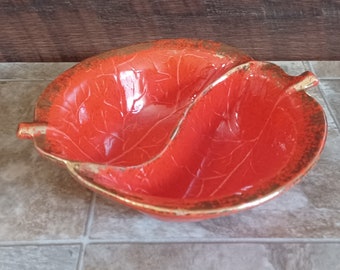
The height and width of the screenshot is (270, 340). In order to click on wall in this screenshot , I will do `click(243, 26)`.